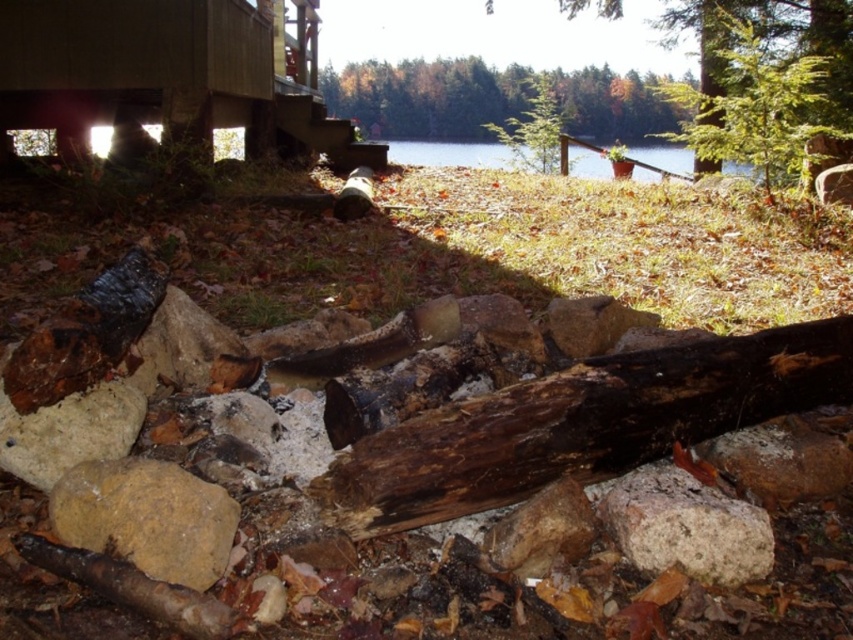
You are planning to place a small potted plant between the yellowish rock at center and the white rough rock at lower left. Based on their sizes, which rock should the plant be closer to?

The yellowish rock at center might be wider than white rough rock at lower left, so the plant should be placed closer to the white rough rock at lower left to ensure enough space.

Based on the photo, you are trying to place a small decorative item between the yellowish rock at center and the white rough rock at lower left. The item is 10 inches long. Will it fit in the space between them?

The yellowish rock at center and white rough rock at lower left are 9.64 inches apart, so the 10 inch item will not fit between them.